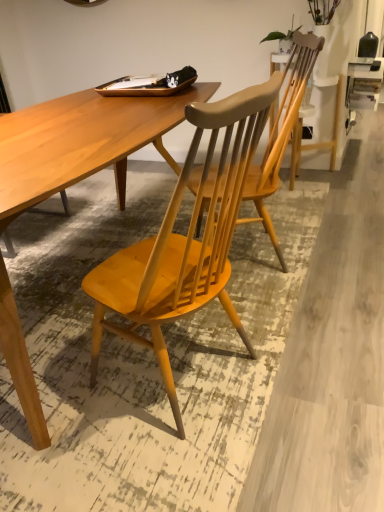
The height and width of the screenshot is (512, 384). What are the coordinates of `empty space that is ontop of light brown wood desk at center (from a real-world perspective)` in the screenshot? It's located at (66, 129).